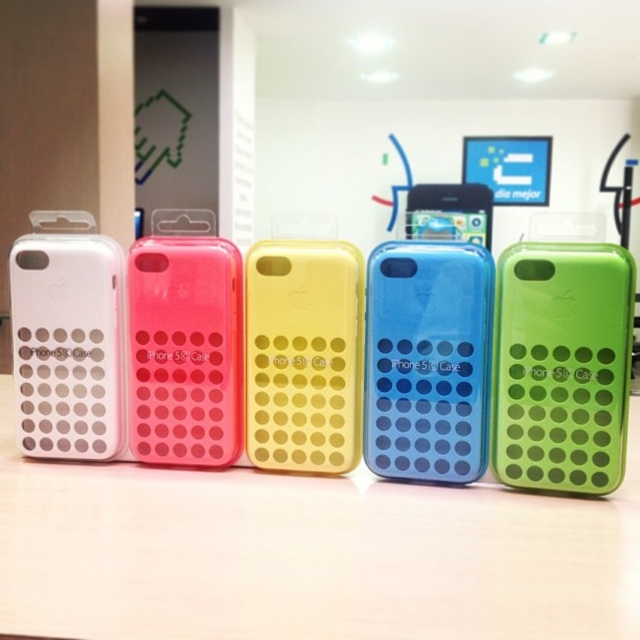
Question: Among these points, which one is farthest from the camera?

Choices:
 (A) (140, 228)
 (B) (273, 432)
 (C) (102, 392)
 (D) (376, 352)

Answer: (A)

Question: Which of the following is the closest to the observer?

Choices:
 (A) matte pink case at center
 (B) pink matte iphone case at center

Answer: (A)

Question: Observing the image, what is the correct spatial positioning of green matte iphone case at center in reference to pink matte iphone case at center?

Choices:
 (A) left
 (B) right

Answer: (B)

Question: Estimate the real-world distances between objects in this image. Which object is closer to the green matte iphone case at center?

Choices:
 (A) translucent blue case at center
 (B) matte white phone case at left

Answer: (A)

Question: Is matte white phone case at left closer to camera compared to blue translucent phone case at center?

Choices:
 (A) no
 (B) yes

Answer: (B)

Question: Considering the relative positions of matte white phone case at left and blue translucent phone case at center in the image provided, where is matte white phone case at left located with respect to blue translucent phone case at center?

Choices:
 (A) below
 (B) above

Answer: (A)